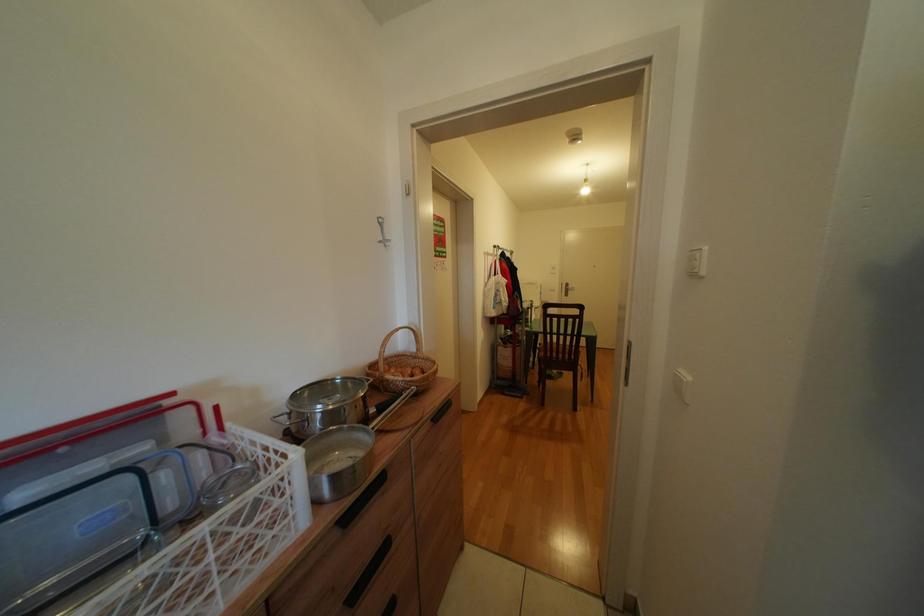
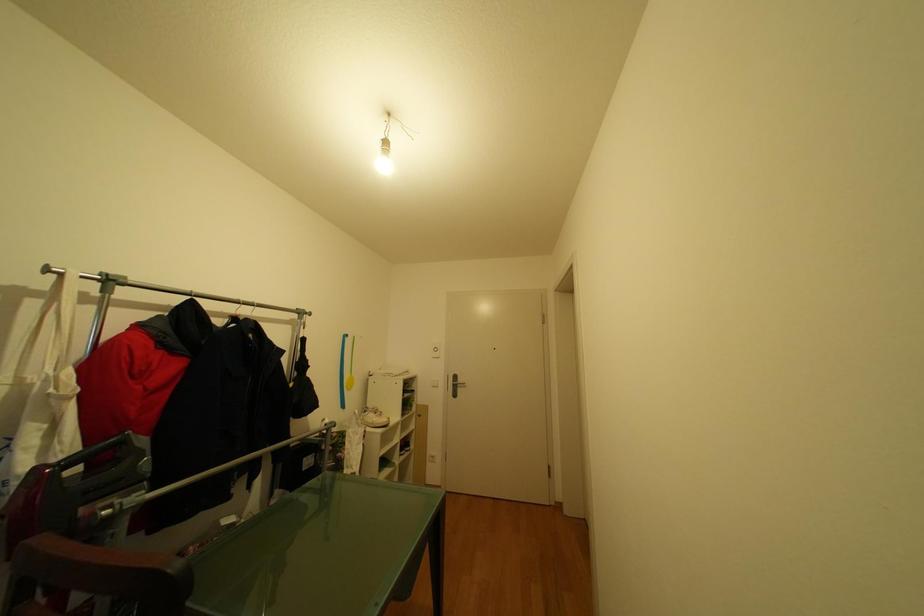
Which direction would the cameraman need to move to produce the second image?

The cameraman moved toward right, forward.